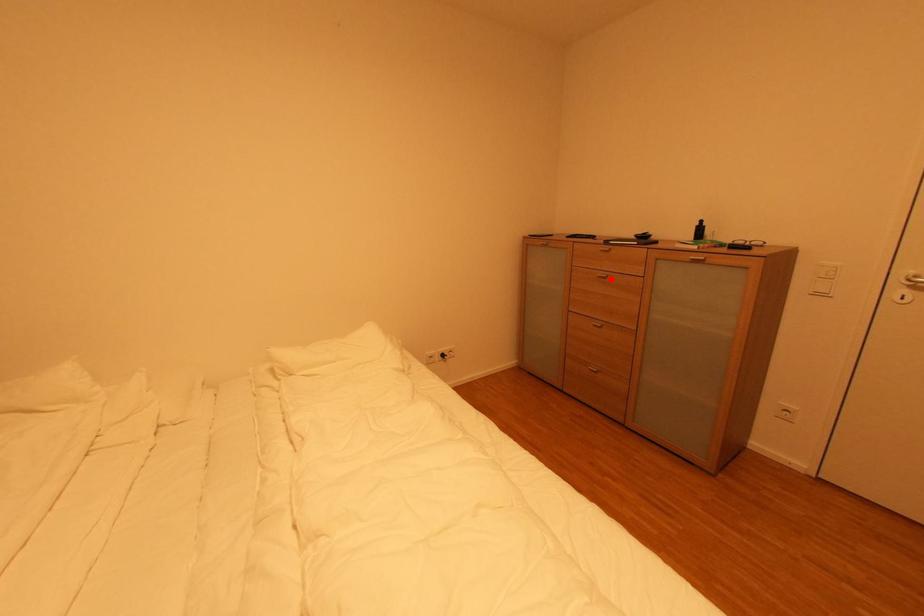
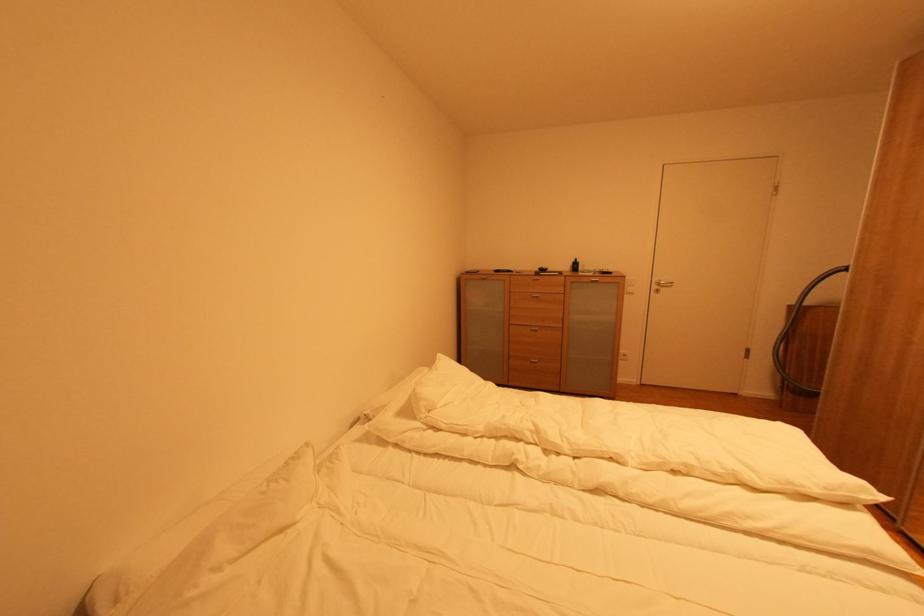
Question: I am providing you with two images of the same scene from different viewpoints. A red point is marked on the first image. At the location where the point appears in image 1, is it still visible in image 2?

Choices:
 (A) Yes
 (B) No

Answer: (A)